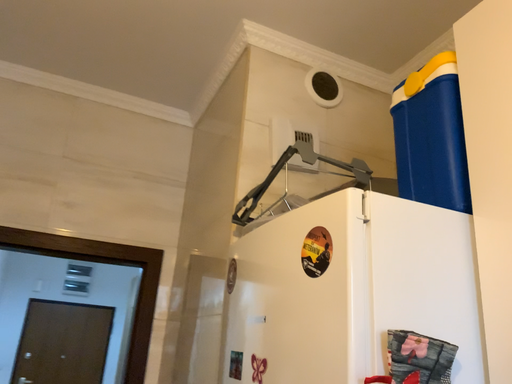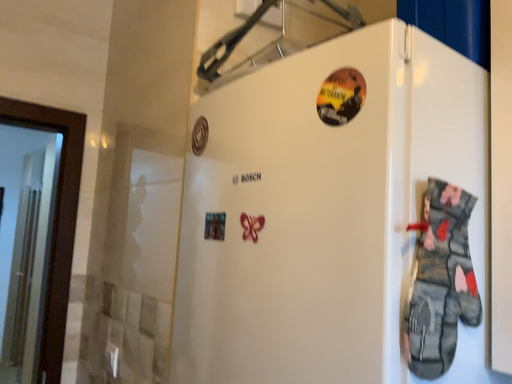
Question: Which way did the camera rotate in the video?

Choices:
 (A) rotated downward
 (B) rotated upward

Answer: (A)